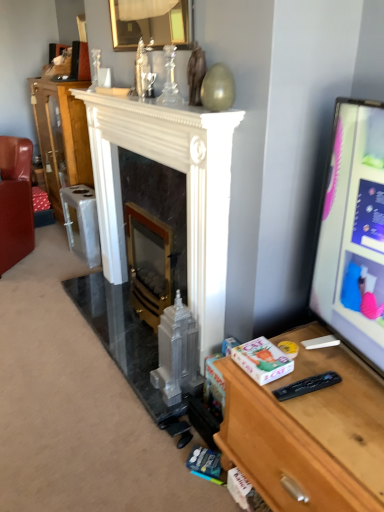
Locate an element on the screen. The width and height of the screenshot is (384, 512). free space in front of matte black monitor at right is located at coordinates (338, 428).